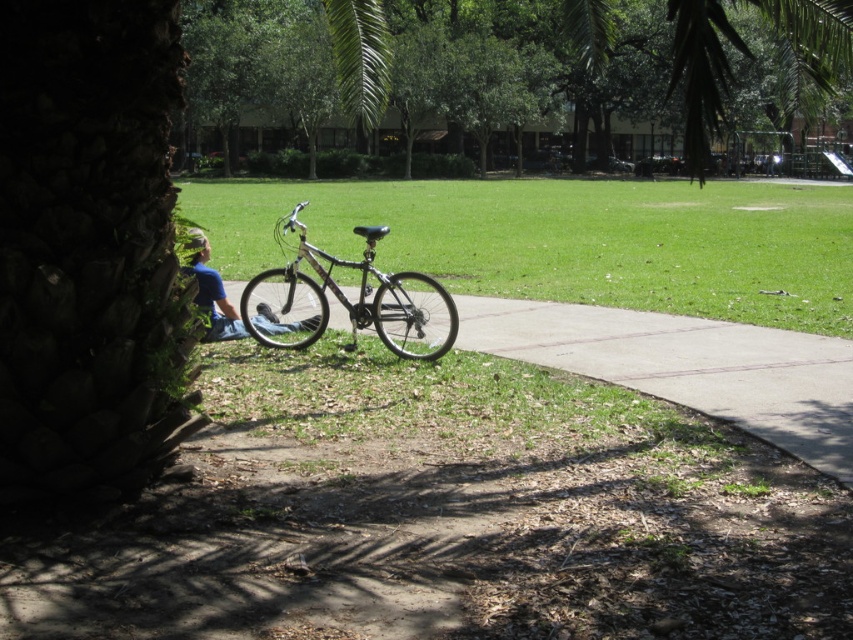
Question: Which object appears farthest from the camera in this image?

Choices:
 (A) green leafy tree at upper center
 (B) gray concrete pavement at center
 (C) silver metallic bicycle at center
 (D) green grass at center

Answer: (D)

Question: Which object is positioned farthest from the green leafy tree at upper center?

Choices:
 (A) green grass at center
 (B) silver metallic bicycle at center

Answer: (A)

Question: In this image, where is gray concrete pavement at center located relative to green leafy tree at upper center?

Choices:
 (A) below
 (B) above

Answer: (A)

Question: Is gray concrete pavement at center smaller than green leafy tree at upper center?

Choices:
 (A) yes
 (B) no

Answer: (A)

Question: Does green grass at center have a smaller size compared to green leafy tree at upper center?

Choices:
 (A) no
 (B) yes

Answer: (B)

Question: Which of these objects is positioned closest to the gray concrete pavement at center?

Choices:
 (A) green grass at center
 (B) silver metallic bicycle at center

Answer: (B)